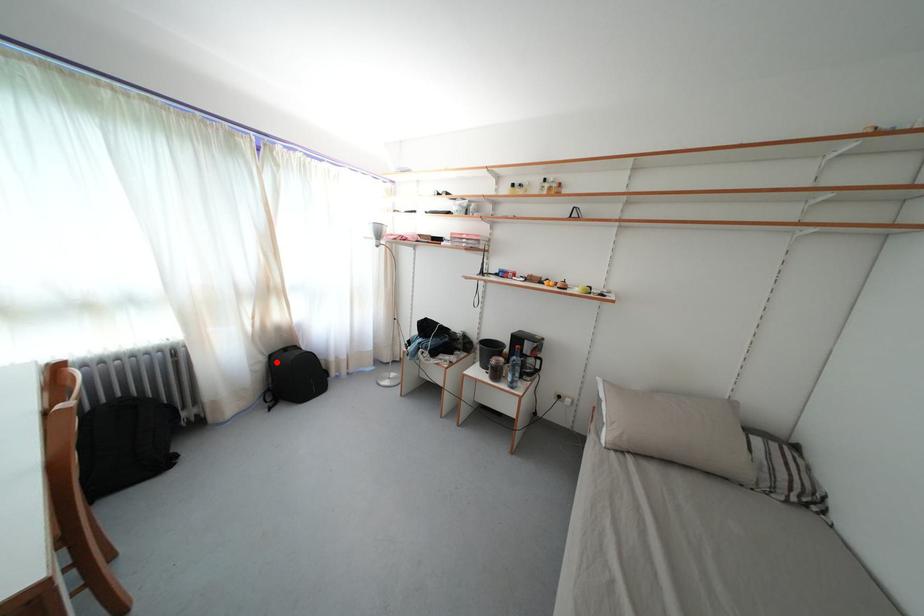
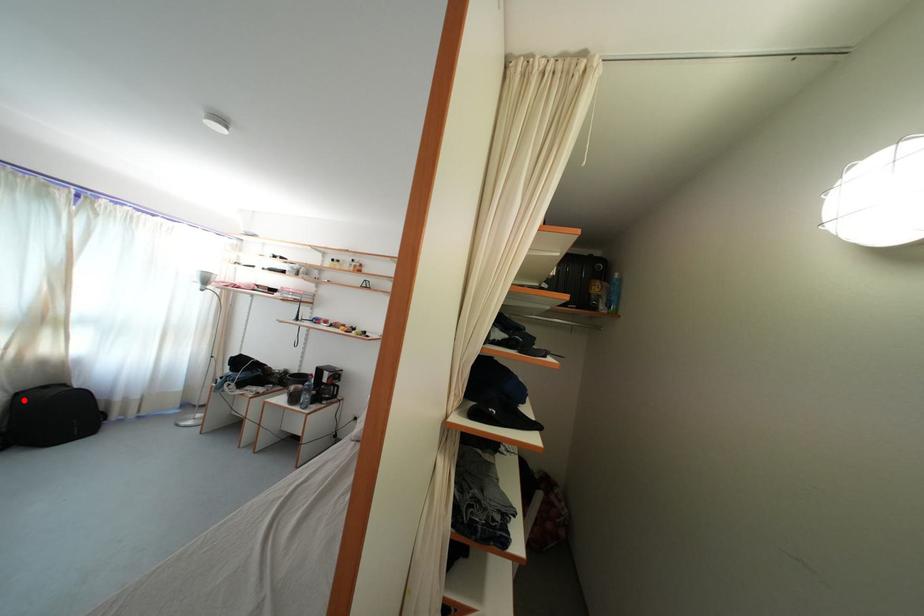
I am providing you with two images of the same scene from different viewpoints. A red point is marked on the first image and another point is marked on the second image. Do the highlighted points in image1 and image2 indicate the same real-world spot?

Yes